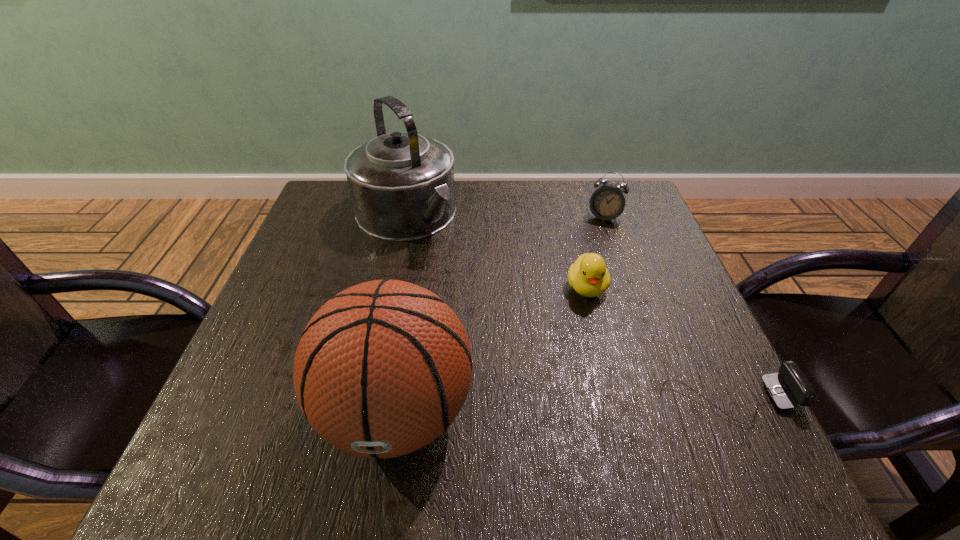
Find the location of a particular element. The width and height of the screenshot is (960, 540). webcam at the right edge is located at coordinates (791, 387).

Identify the location of alarm clock positioned at the right edge. Image resolution: width=960 pixels, height=540 pixels. (608, 201).

In order to click on object situated at the far left corner in this screenshot , I will do `click(402, 188)`.

Find the location of a particular element. Image resolution: width=960 pixels, height=540 pixels. object that is at the far right corner is located at coordinates (608, 201).

The height and width of the screenshot is (540, 960). Find the location of `object present at the near right corner`. object present at the near right corner is located at coordinates (791, 387).

In the image, there is a desktop. Where is `vacant space at the far edge`? The width and height of the screenshot is (960, 540). vacant space at the far edge is located at coordinates (503, 210).

At what (x,y) coordinates should I click in order to perform the action: click on vacant point at the left edge. Please return your answer as a coordinate pair (x, y). This screenshot has width=960, height=540. Looking at the image, I should click on (359, 244).

Where is `vacant region at the right edge`? This screenshot has width=960, height=540. vacant region at the right edge is located at coordinates (667, 332).

This screenshot has width=960, height=540. In the image, there is a desktop. In order to click on free space at the far left corner in this screenshot , I will do `click(322, 227)`.

At what (x,y) coordinates should I click in order to perform the action: click on free space at the near left corner. Please return your answer as a coordinate pair (x, y). The height and width of the screenshot is (540, 960). Looking at the image, I should click on (249, 406).